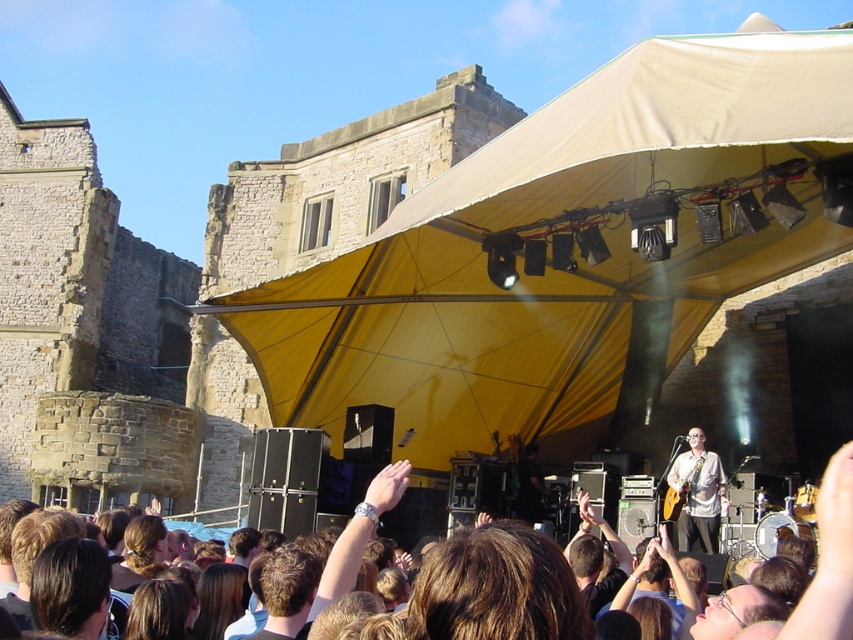
Question: Can you confirm if yellow fabric canopy at upper center is positioned to the left of light brown wood guitar at center?

Choices:
 (A) yes
 (B) no

Answer: (A)

Question: Can you confirm if yellow fabric canopy at upper center is bigger than light brown wood guitar at center?

Choices:
 (A) no
 (B) yes

Answer: (B)

Question: Which point is closer to the camera?

Choices:
 (A) yellow fabric canopy at upper center
 (B) light brown wood guitar at center

Answer: (A)

Question: Is yellow fabric canopy at upper center to the left of light brown wood guitar at center from the viewer's perspective?

Choices:
 (A) no
 (B) yes

Answer: (B)